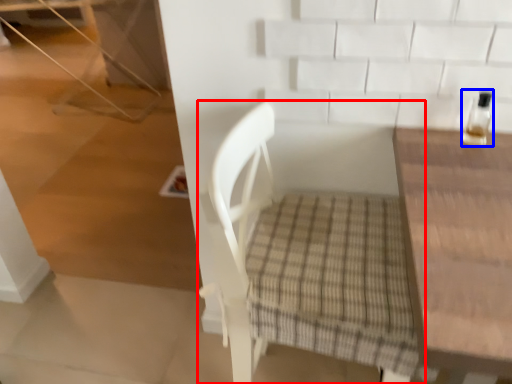
Question: Which point is closer to the camera, chair (highlighted by a red box) or bottle (highlighted by a blue box)?

Choices:
 (A) chair
 (B) bottle

Answer: (A)